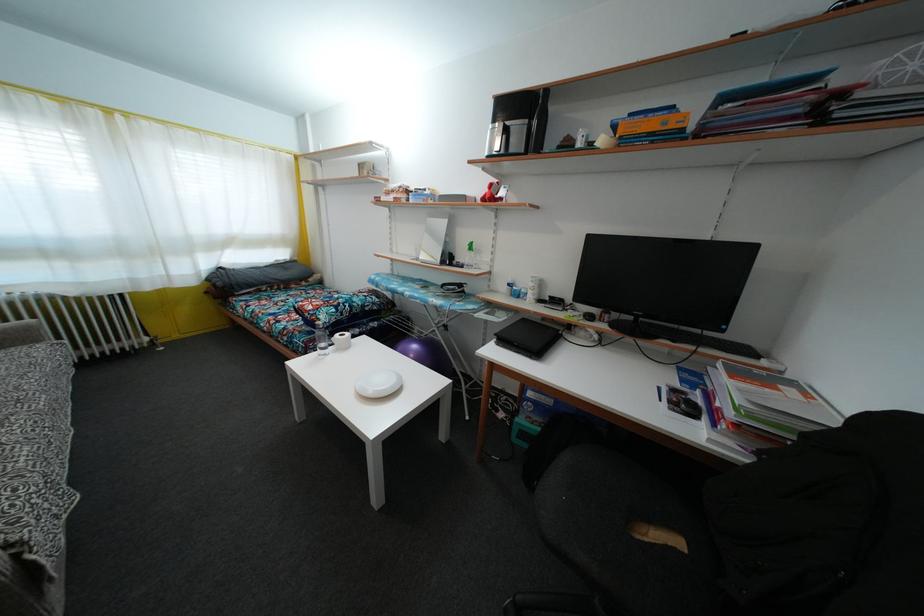
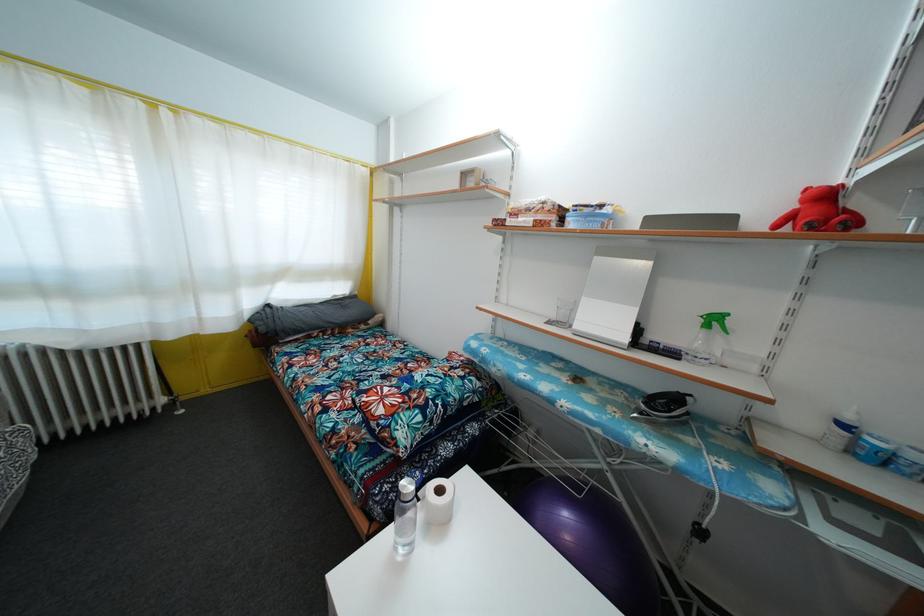
From the picture: What movement of the cameraman would produce the second image?

The cameraman moved toward left, forward.